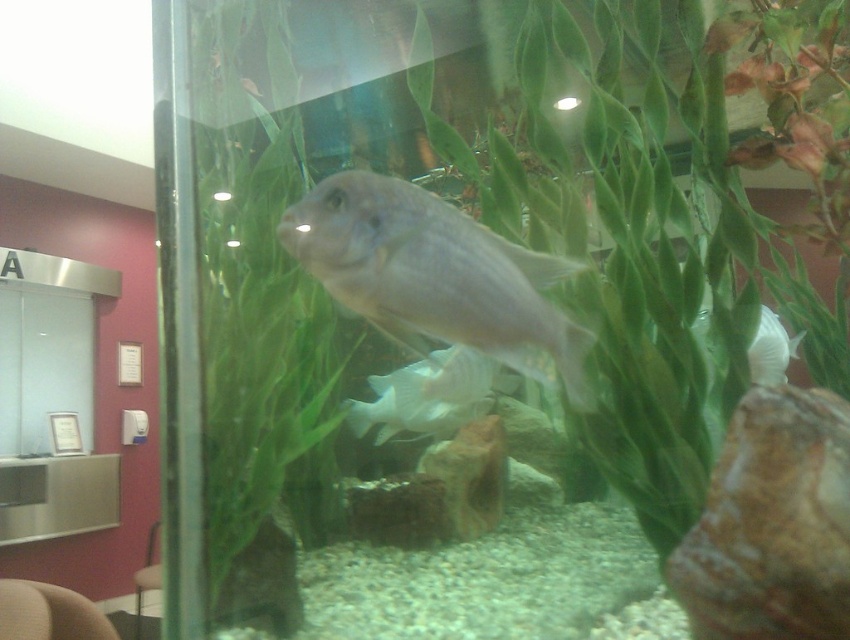
You are an aquatic maintenance worker observing the fish tank. You notice the matte gray fish at center and the white matte shell at center. Which object is taller in the tank?

The matte gray fish at center is taller than the white matte shell at center.

You are a visitor standing in front of the fish tank. You want to take a photo of the white matte fish at center with your phone. The phone has a minimum focus distance of 1 foot. Can you focus on the fish?

The white matte fish at center is 5.75 feet away from the camera, which is beyond the phone camera minimum focus distance of 1 foot. Therefore, you can focus on the fish.

You are standing in front of a fish tank and want to touch the point at coordinates point (578, 365) in the tank. The tank is 40 inches deep. Can you reach the point without bending down?

The distance of point (578, 365) from viewer is 37.10 inches, which is less than the tank depth of 40 inches. Therefore, you can reach the point without bending down.